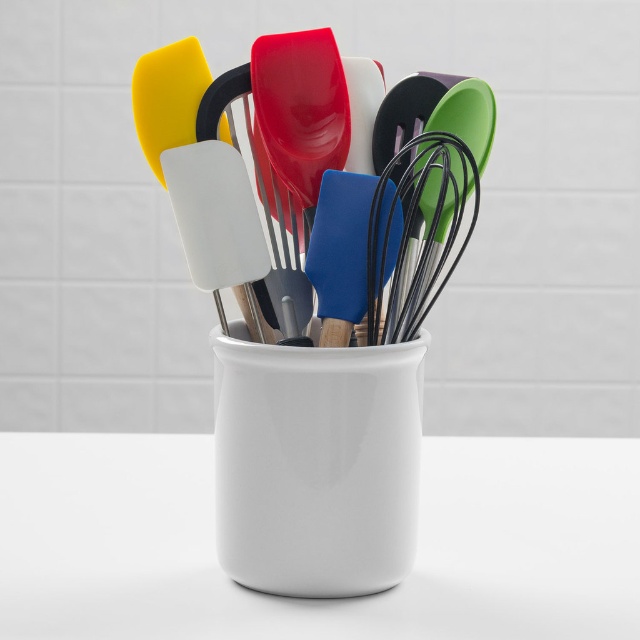
Question: Can you confirm if black wire whisk at center is wider than matte white spatula at upper left?

Choices:
 (A) no
 (B) yes

Answer: (A)

Question: Which object appears farthest from the camera in this image?

Choices:
 (A) matte white spatula at upper left
 (B) black wire whisk at center

Answer: (A)

Question: Which point is closer to the camera?

Choices:
 (A) (401, 202)
 (B) (176, 122)

Answer: (B)

Question: Does black wire whisk at center lie in front of matte white spatula at upper left?

Choices:
 (A) yes
 (B) no

Answer: (A)

Question: Which object is closer to the camera taking this photo?

Choices:
 (A) black wire whisk at center
 (B) matte white spatula at upper left

Answer: (A)

Question: Does black wire whisk at center appear over matte white spatula at upper left?

Choices:
 (A) no
 (B) yes

Answer: (A)